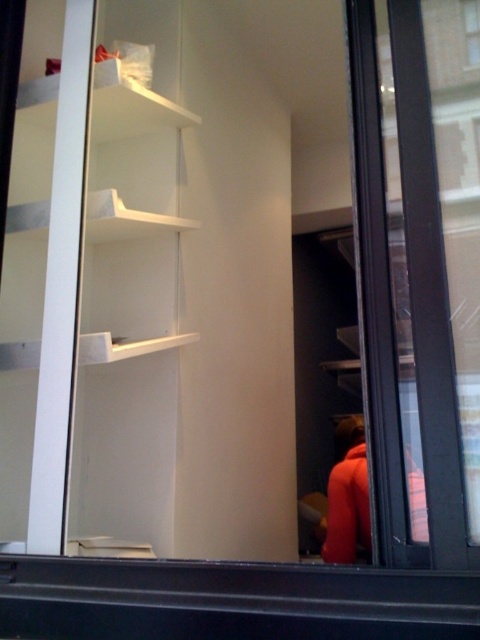
You are standing outside the window and want to see the orange fabric jacket at right and the clear glass window at upper right. Which object is taller?

The orange fabric jacket at right is taller than the clear glass window at upper right according to the description.

You are standing outside the window and want to enter the room through the transparent glass door at right. The orange fabric jacket at right is hanging on a hook next to the door. Can you walk through the door without touching the jacket?

The transparent glass door at right is much taller than the orange fabric jacket at right, so yes, you can walk through the door without touching the jacket as there is enough vertical space between them.